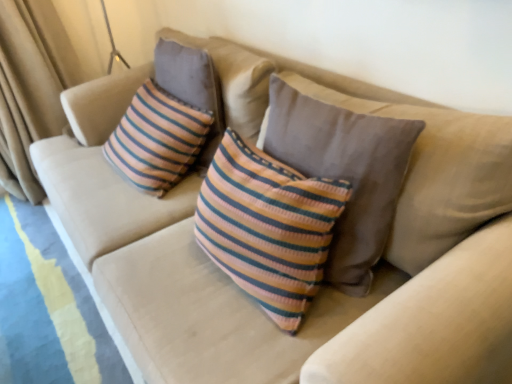
Question: Which is correct: knitted striped pillow at center is inside beige fabric curtain at left, or outside of it?

Choices:
 (A) outside
 (B) inside

Answer: (A)

Question: From the image's perspective, is knitted striped pillow at center positioned above or below beige fabric curtain at left?

Choices:
 (A) below
 (B) above

Answer: (A)

Question: Considering the positions of knitted striped pillow at center and beige fabric curtain at left in the image, is knitted striped pillow at center wider or thinner than beige fabric curtain at left?

Choices:
 (A) wide
 (B) thin

Answer: (B)

Question: Based on their sizes in the image, would you say beige fabric curtain at left is bigger or smaller than knitted striped pillow at center?

Choices:
 (A) big
 (B) small

Answer: (A)

Question: From the image's perspective, relative to knitted striped pillow at center, is beige fabric curtain at left above or below?

Choices:
 (A) above
 (B) below

Answer: (A)

Question: From a real-world perspective, relative to knitted striped pillow at center, is beige fabric curtain at left vertically above or below?

Choices:
 (A) below
 (B) above

Answer: (A)

Question: Would you say beige fabric curtain at left is to the left or to the right of knitted striped pillow at center in the picture?

Choices:
 (A) right
 (B) left

Answer: (B)